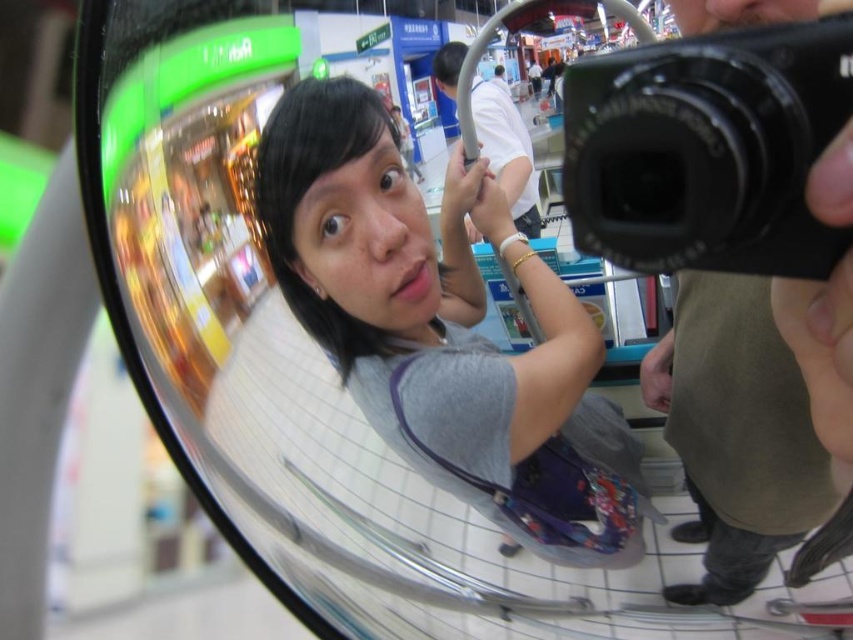
Question: Is the position of gray fabric shirt at center less distant than that of black plastic camera at upper right?

Choices:
 (A) yes
 (B) no

Answer: (B)

Question: Which point is closer to the camera?

Choices:
 (A) black plastic camera at upper right
 (B) gray fabric shirt at center

Answer: (A)

Question: Is gray fabric shirt at center thinner than black plastic camera at upper right?

Choices:
 (A) yes
 (B) no

Answer: (B)

Question: Considering the relative positions of gray fabric shirt at center and black plastic camera at upper right in the image provided, where is gray fabric shirt at center located with respect to black plastic camera at upper right?

Choices:
 (A) below
 (B) above

Answer: (A)